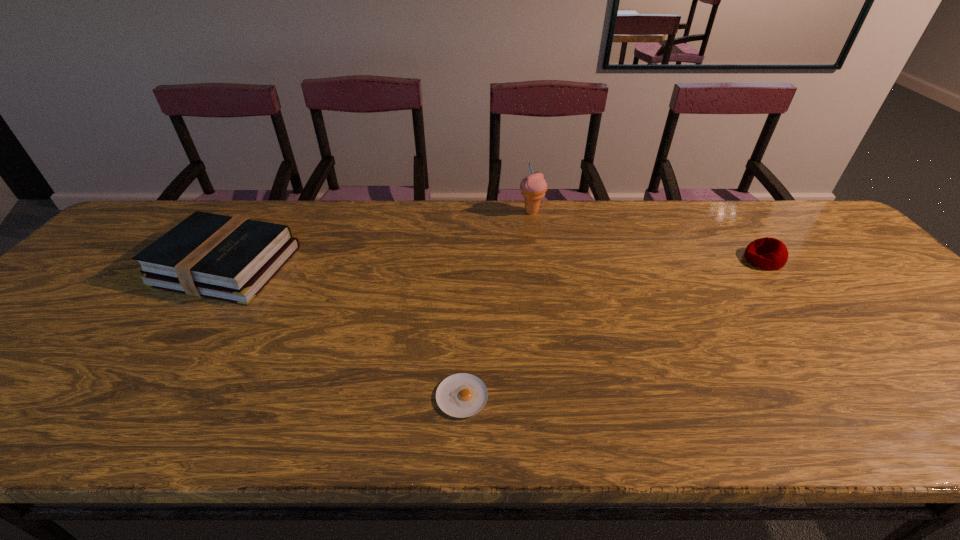
Locate an element on the screen. vacant space in between the hardback book and the third object from right to left is located at coordinates (344, 331).

This screenshot has height=540, width=960. Find the location of `the second closest object to the shortest object`. the second closest object to the shortest object is located at coordinates (533, 187).

Locate which object ranks in proximity to the second object from left to right. Please provide its 2D coordinates. Your answer should be formatted as a tuple, i.e. [(x, y)], where the tuple contains the x and y coordinates of a point satisfying the conditions above.

[(221, 257)]

Identify the location of vacant position in the image that satisfies the following two spatial constraints: 1. on the back side of the tallest object; 2. on the right side of the third object from right to left. The image size is (960, 540). (468, 212).